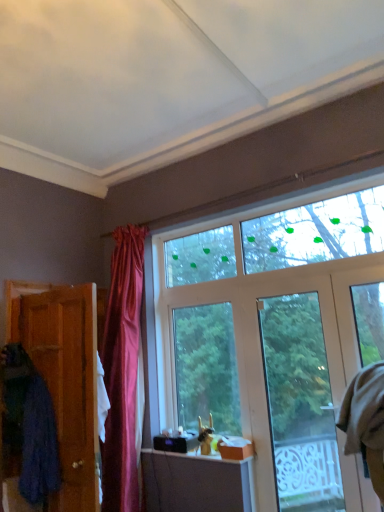
The height and width of the screenshot is (512, 384). Describe the element at coordinates (366, 421) in the screenshot. I see `beige fabric robe at right, which ranks as the first robe in right-to-left order` at that location.

Identify the location of blue fabric robe at left, the 1th robe when ordered from left to right. (29, 425).

Is clear glass door at center smaller than blue fabric robe at left, positioned as the 2th robe in right-to-left order?

Yes, clear glass door at center is smaller than blue fabric robe at left, positioned as the 2th robe in right-to-left order.

Between point (330, 503) and point (40, 394), which one is positioned in front?

The point (40, 394) is closer.

From the image's perspective, which is below, clear glass door at center or blue fabric robe at left, positioned as the 2th robe in right-to-left order?

blue fabric robe at left, positioned as the 2th robe in right-to-left order.

Is beige fabric robe at right, which ranks as the first robe in right-to-left order, taller than blue fabric robe at left, positioned as the 2th robe in right-to-left order?

Correct, beige fabric robe at right, which ranks as the first robe in right-to-left order, is much taller as blue fabric robe at left, positioned as the 2th robe in right-to-left order.

Looking at this image, from a real-world perspective, is beige fabric robe at right, which is the 2th robe in left-to-right order, over blue fabric robe at left, the 1th robe when ordered from left to right?

Yes.

From the image's perspective, is beige fabric robe at right, which ranks as the first robe in right-to-left order, on top of blue fabric robe at left, the 1th robe when ordered from left to right?

Yes, from the image's perspective, beige fabric robe at right, which ranks as the first robe in right-to-left order, is on top of blue fabric robe at left, the 1th robe when ordered from left to right.

Measure the distance from beige fabric robe at right, which ranks as the first robe in right-to-left order, to blue fabric robe at left, the 1th robe when ordered from left to right.

beige fabric robe at right, which ranks as the first robe in right-to-left order, and blue fabric robe at left, the 1th robe when ordered from left to right, are 1.96 meters apart from each other.

In the scene shown: Does blue fabric robe at left, positioned as the 2th robe in right-to-left order, have a lesser width compared to beige fabric robe at right, which is the 2th robe in left-to-right order?

Incorrect, the width of blue fabric robe at left, positioned as the 2th robe in right-to-left order, is not less than that of beige fabric robe at right, which is the 2th robe in left-to-right order.

What's the angular difference between blue fabric robe at left, the 1th robe when ordered from left to right, and beige fabric robe at right, which is the 2th robe in left-to-right order,'s facing directions?

→ There is a 90.1-degree angle between the facing directions of blue fabric robe at left, the 1th robe when ordered from left to right, and beige fabric robe at right, which is the 2th robe in left-to-right order.

Is blue fabric robe at left, positioned as the 2th robe in right-to-left order, far from beige fabric robe at right, which ranks as the first robe in right-to-left order?

blue fabric robe at left, positioned as the 2th robe in right-to-left order, is far away from beige fabric robe at right, which ranks as the first robe in right-to-left order.

Between blue fabric robe at left, the 1th robe when ordered from left to right, and beige fabric robe at right, which is the 2th robe in left-to-right order, which one has larger size?

Bigger between the two is blue fabric robe at left, the 1th robe when ordered from left to right.

Is beige fabric robe at right, which ranks as the first robe in right-to-left order, smaller than wooden door at left?

Yes, beige fabric robe at right, which ranks as the first robe in right-to-left order, is smaller than wooden door at left.

From the picture: Which object is further away from the camera, beige fabric robe at right, which is the 2th robe in left-to-right order, or wooden door at left?

wooden door at left is behind.

Which point is more distant from viewer, (356, 409) or (87, 458)?

The point (87, 458) is farther.

Considering the relative positions of beige fabric robe at right, which ranks as the first robe in right-to-left order, and wooden door at left in the image provided, is beige fabric robe at right, which ranks as the first robe in right-to-left order, to the left or to the right of wooden door at left?

Based on their positions, beige fabric robe at right, which ranks as the first robe in right-to-left order, is located to the right of wooden door at left.

This screenshot has width=384, height=512. I want to click on robe that is the 1st one when counting forward from the clear glass door at center, so click(x=366, y=421).

Is point (383, 376) closer to viewer compared to point (277, 343)?

Yes, point (383, 376) is in front of point (277, 343).

Which is correct: beige fabric robe at right, which ranks as the first robe in right-to-left order, is inside clear glass door at center, or outside of it?

The correct answer is: outside.

Would you consider beige fabric robe at right, which ranks as the first robe in right-to-left order, to be distant from clear glass door at center?

Absolutely, beige fabric robe at right, which ranks as the first robe in right-to-left order, is distant from clear glass door at center.

Which of these two, wooden door at left or clear glass door at center, is wider?

wooden door at left.

From a real-world perspective, is wooden door at left under clear glass door at center?

Actually, wooden door at left is physically above clear glass door at center in the real world.

Where is `door above the clear glass door at center (from the image's perspective)`? door above the clear glass door at center (from the image's perspective) is located at coordinates (67, 382).

Who is more distant, wooden door at left or clear glass door at center?

clear glass door at center is further from the camera.

Where is `robe to the right of wooden door at left`? The image size is (384, 512). robe to the right of wooden door at left is located at coordinates (366, 421).

Would you say wooden door at left is outside beige fabric robe at right, which is the 2th robe in left-to-right order?

Yes, wooden door at left is located beyond the bounds of beige fabric robe at right, which is the 2th robe in left-to-right order.

Considering the positions of points (68, 321) and (377, 425), is point (68, 321) farther from camera compared to point (377, 425)?

Yes, point (68, 321) is behind point (377, 425).

Image resolution: width=384 pixels, height=512 pixels. In order to click on the 2nd robe in front of the clear glass door at center, starting your count from the anchor in this screenshot , I will do `click(29, 425)`.

The image size is (384, 512). In order to click on robe above the blue fabric robe at left, positioned as the 2th robe in right-to-left order (from the image's perspective) in this screenshot , I will do `click(366, 421)`.

From the image, which object appears to be farther from beige fabric robe at right, which ranks as the first robe in right-to-left order, wooden door at left or clear glass door at center?

Based on the image, clear glass door at center appears to be further to beige fabric robe at right, which ranks as the first robe in right-to-left order.

Estimate the real-world distances between objects in this image. Which object is closer to blue fabric robe at left, the 1th robe when ordered from left to right, beige fabric robe at right, which ranks as the first robe in right-to-left order, or wooden door at left?

wooden door at left is closer to blue fabric robe at left, the 1th robe when ordered from left to right.

Looking at the image, which one is located closer to blue fabric robe at left, positioned as the 2th robe in right-to-left order, beige fabric robe at right, which ranks as the first robe in right-to-left order, or clear glass door at center?

beige fabric robe at right, which ranks as the first robe in right-to-left order, is positioned closer to the anchor blue fabric robe at left, positioned as the 2th robe in right-to-left order.

Considering their positions, is clear glass door at center positioned closer to wooden door at left than beige fabric robe at right, which ranks as the first robe in right-to-left order?

beige fabric robe at right, which ranks as the first robe in right-to-left order.

Looking at the image, which one is located closer to blue fabric robe at left, positioned as the 2th robe in right-to-left order, wooden door at left or clear glass door at center?

The object closer to blue fabric robe at left, positioned as the 2th robe in right-to-left order, is wooden door at left.

Looking at the image, which one is located further to clear glass door at center, blue fabric robe at left, the 1th robe when ordered from left to right, or beige fabric robe at right, which ranks as the first robe in right-to-left order?

blue fabric robe at left, the 1th robe when ordered from left to right.

From the image, which object appears to be nearer to wooden door at left, beige fabric robe at right, which ranks as the first robe in right-to-left order, or clear glass door at center?

Among the two, beige fabric robe at right, which ranks as the first robe in right-to-left order, is located nearer to wooden door at left.

Estimate the real-world distances between objects in this image. Which object is closer to wooden door at left, clear glass door at center or blue fabric robe at left, the 1th robe when ordered from left to right?

blue fabric robe at left, the 1th robe when ordered from left to right, is closer to wooden door at left.

Locate an element on the screen. This screenshot has width=384, height=512. door located between blue fabric robe at left, positioned as the 2th robe in right-to-left order, and beige fabric robe at right, which is the 2th robe in left-to-right order, in the left-right direction is located at coordinates (67, 382).

Identify the location of glass door located between blue fabric robe at left, positioned as the 2th robe in right-to-left order, and beige fabric robe at right, which is the 2th robe in left-to-right order, in the left-right direction. (300, 404).

The width and height of the screenshot is (384, 512). In order to click on glass door between wooden door at left and beige fabric robe at right, which ranks as the first robe in right-to-left order, in the horizontal direction in this screenshot , I will do `click(300, 404)`.

Locate an element on the screen. The width and height of the screenshot is (384, 512). door between blue fabric robe at left, positioned as the 2th robe in right-to-left order, and clear glass door at center, in the horizontal direction is located at coordinates (67, 382).